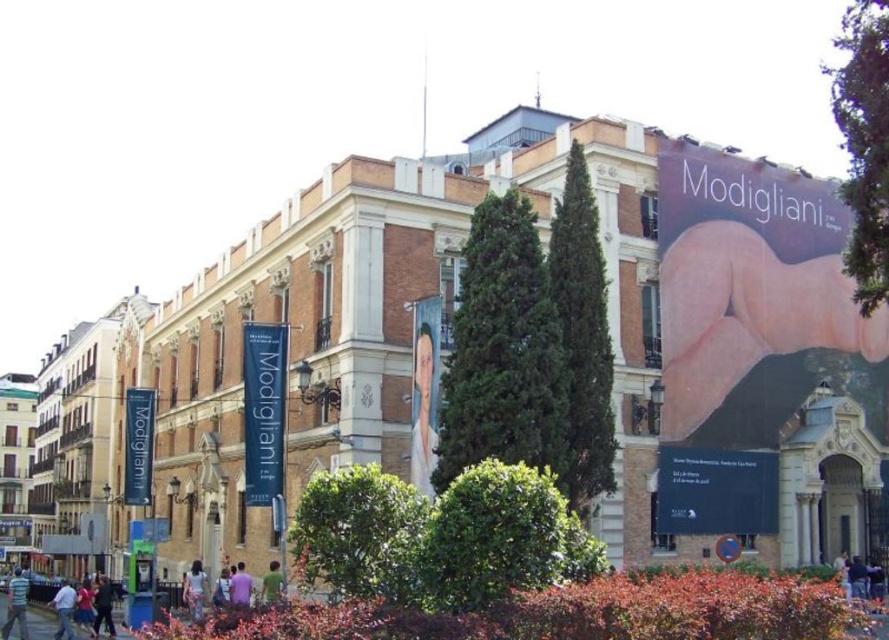
Does floral dress at lower left appear over light brown leather jacket at lower center?

No.

Which is behind, point (189, 609) or point (221, 600)?

Point (189, 609)

The width and height of the screenshot is (889, 640). What are the coordinates of `floral dress at lower left` in the screenshot? It's located at (194, 589).

Locate an element on the screen. floral dress at lower left is located at coordinates (194, 589).

Can you confirm if floral dress at lower left is bigger than light blue jeans at lower left?

No.

Is point (199, 604) in front of point (70, 593)?

Yes.

Identify the location of floral dress at lower left. (194, 589).

What do you see at coordinates (63, 609) in the screenshot? This screenshot has width=889, height=640. I see `light blue jeans at lower left` at bounding box center [63, 609].

Does light blue jeans at lower left have a lesser height compared to light brown leather jacket at lower center?

No, light blue jeans at lower left is not shorter than light brown leather jacket at lower center.

What are the coordinates of `light blue jeans at lower left` in the screenshot? It's located at (63, 609).